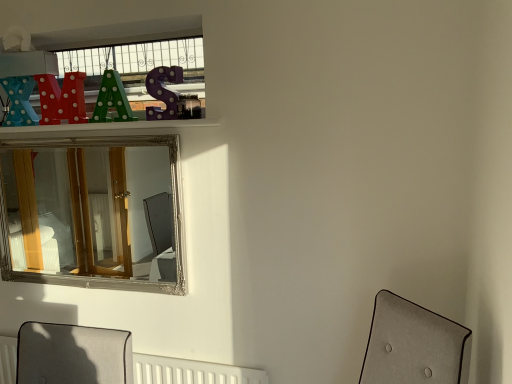
Describe the element at coordinates (191, 372) in the screenshot. I see `white textured radiator at lower center` at that location.

I want to click on white textured radiator at lower center, so click(191, 372).

Where is `silver/gilded mirror at upper center`? silver/gilded mirror at upper center is located at coordinates tap(88, 210).

Describe the element at coordinates (88, 210) in the screenshot. The image size is (512, 384). I see `silver/gilded mirror at upper center` at that location.

The image size is (512, 384). I want to click on white textured radiator at lower center, so tap(191, 372).

Which object is positioned more to the right, white textured radiator at lower center or silver/gilded mirror at upper center?

white textured radiator at lower center.

Is white textured radiator at lower center closer to the viewer compared to silver/gilded mirror at upper center?

No, it is behind silver/gilded mirror at upper center.

Does point (179, 379) come closer to viewer compared to point (17, 243)?

Yes, it is.

From the image's perspective, is white textured radiator at lower center on silver/gilded mirror at upper center?

No, from the image's perspective, white textured radiator at lower center is not over silver/gilded mirror at upper center.

From a real-world perspective, is white textured radiator at lower center positioned under silver/gilded mirror at upper center based on gravity?

Indeed, from a real-world perspective, white textured radiator at lower center is positioned beneath silver/gilded mirror at upper center.

Considering the relative sizes of white textured radiator at lower center and silver/gilded mirror at upper center in the image provided, is white textured radiator at lower center wider than silver/gilded mirror at upper center?

Incorrect, the width of white textured radiator at lower center does not surpass that of silver/gilded mirror at upper center.

Which of these two, white textured radiator at lower center or silver/gilded mirror at upper center, stands shorter?

white textured radiator at lower center.

Which of these two, white textured radiator at lower center or silver/gilded mirror at upper center, is smaller?

With smaller size is white textured radiator at lower center.

Would you say white textured radiator at lower center is outside silver/gilded mirror at upper center?

Yes, white textured radiator at lower center is located beyond the bounds of silver/gilded mirror at upper center.

Is white textured radiator at lower center in contact with silver/gilded mirror at upper center?

No, white textured radiator at lower center is not with silver/gilded mirror at upper center.

From the picture: Could you tell me if white textured radiator at lower center is facing silver/gilded mirror at upper center?

No.

Measure the distance between white textured radiator at lower center and silver/gilded mirror at upper center.

They are 2.44 meters apart.

The width and height of the screenshot is (512, 384). There is a white textured radiator at lower center. In order to click on mirror above it (from a real-world perspective) in this screenshot , I will do `click(88, 210)`.

Considering the relative positions of silver/gilded mirror at upper center and white textured radiator at lower center in the image provided, is silver/gilded mirror at upper center to the left or to the right of white textured radiator at lower center?

silver/gilded mirror at upper center is to the left of white textured radiator at lower center.

Is the depth of silver/gilded mirror at upper center less than that of white textured radiator at lower center?

Yes, it is.

Does point (37, 236) lie behind point (203, 376)?

Yes.

From the image's perspective, relative to white textured radiator at lower center, is silver/gilded mirror at upper center above or below?

silver/gilded mirror at upper center is situated higher than white textured radiator at lower center in the image.

From a real-world perspective, who is located lower, silver/gilded mirror at upper center or white textured radiator at lower center?

From a 3D spatial view, white textured radiator at lower center is below.

Looking at this image, is silver/gilded mirror at upper center thinner than white textured radiator at lower center?

Incorrect, the width of silver/gilded mirror at upper center is not less than that of white textured radiator at lower center.

Which of these two, silver/gilded mirror at upper center or white textured radiator at lower center, stands taller?

silver/gilded mirror at upper center is taller.

Based on their sizes in the image, would you say silver/gilded mirror at upper center is bigger or smaller than white textured radiator at lower center?

Clearly, silver/gilded mirror at upper center is larger in size than white textured radiator at lower center.

Which is correct: silver/gilded mirror at upper center is inside white textured radiator at lower center, or outside of it?

silver/gilded mirror at upper center exists outside the volume of white textured radiator at lower center.

From the picture: Is silver/gilded mirror at upper center not close to white textured radiator at lower center?

Indeed, silver/gilded mirror at upper center is not near white textured radiator at lower center.

Could you tell me if silver/gilded mirror at upper center is facing white textured radiator at lower center?

No, silver/gilded mirror at upper center is not facing towards white textured radiator at lower center.

How many degrees apart are the facing directions of silver/gilded mirror at upper center and white textured radiator at lower center?

There is a 1.73-degree angle between the facing directions of silver/gilded mirror at upper center and white textured radiator at lower center.

The width and height of the screenshot is (512, 384). Identify the location of radiator behind the silver/gilded mirror at upper center. (191, 372).

At what (x,y) coordinates should I click in order to perform the action: click on mirror above the white textured radiator at lower center (from the image's perspective). Please return your answer as a coordinate pair (x, y). This screenshot has height=384, width=512. Looking at the image, I should click on (88, 210).

In the image, there is a silver/gilded mirror at upper center. In order to click on radiator below it (from the image's perspective) in this screenshot , I will do `click(191, 372)`.